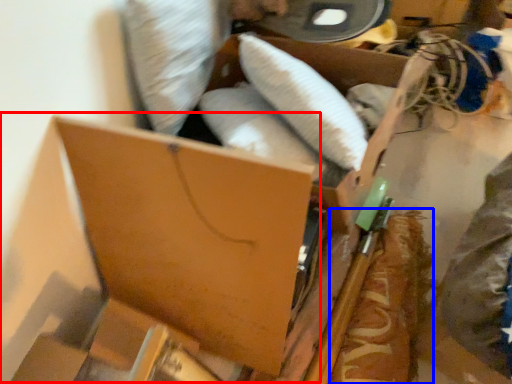
Question: Among these objects, which one is farthest to the camera, storage box (highlighted by a red box) or food (highlighted by a blue box)?

Choices:
 (A) storage box
 (B) food

Answer: (B)